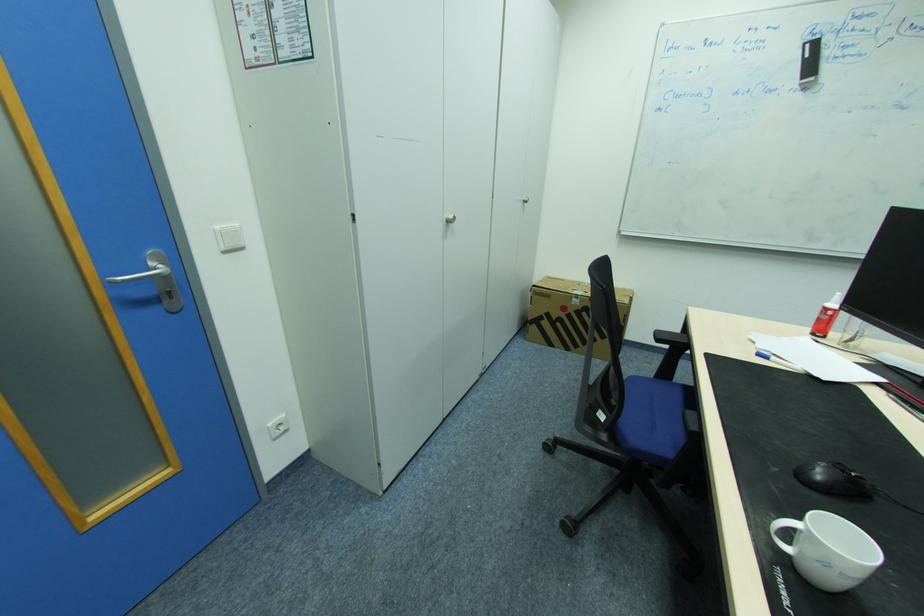
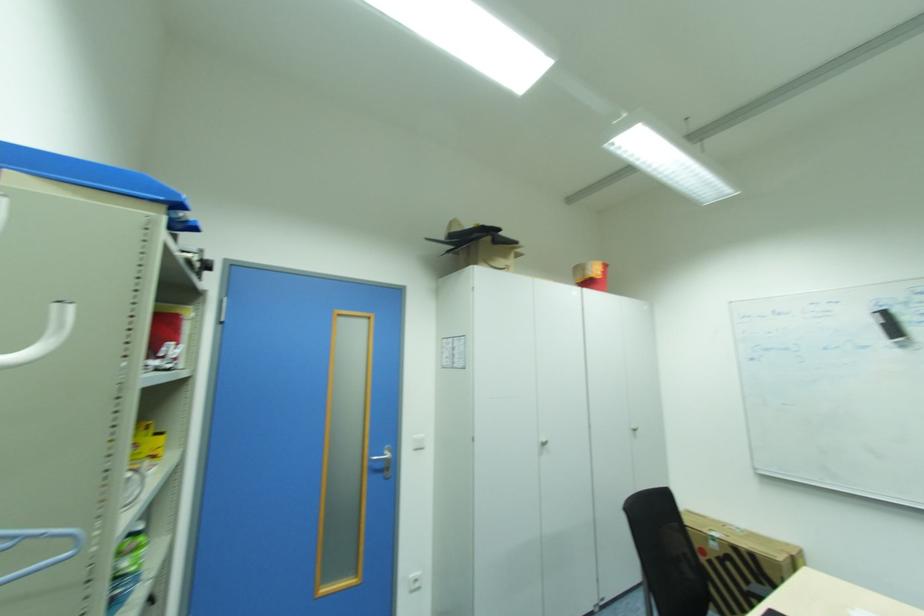
The first image is from the beginning of the video and the second image is from the end. How did the camera likely rotate when shooting the video?

The camera's rotation is toward left-up.